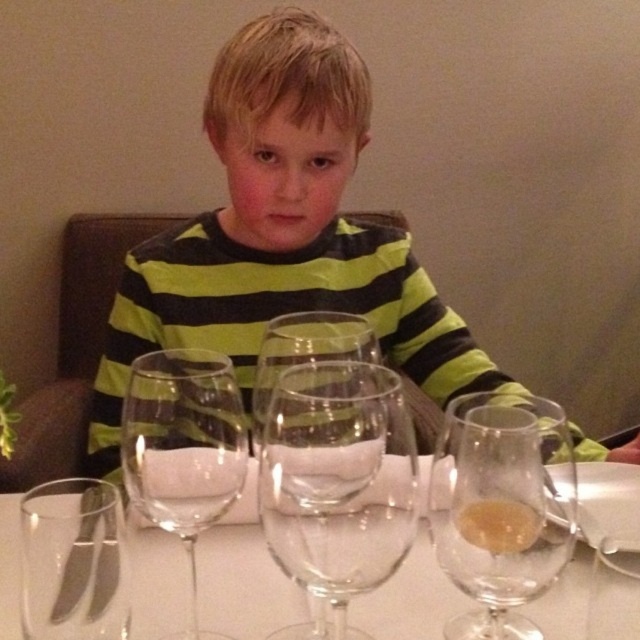
You are a waiter standing at the edge of the table. You need to pick up the translucent glass wine glass at center without touching any other objects. Can you reach it?

The distance between the translucent glass wine glass at center and the viewer is 17.72 inches. Since the average human arm can reach approximately 24 inches, the waiter can easily reach the translucent glass wine glass at center without needing to move closer.

You are a waiter at a restaurant and need to select a wine glass for a customer who prefers a taller glass. Which glass should you choose between the transparent glass wine glass at center and the translucent glass wine glass at center?

The transparent glass wine glass at center has a greater height compared to the translucent glass wine glass at center, so you should choose the transparent glass wine glass at center.

You are a waiter in a restaurant and you need to place a new wine glass on the table. The table has a transparent glass wine glass at center and a translucent glass wine glass at center. Which glass should you place your new wine glass behind to ensure it is closer to the customer?

You should place the new wine glass behind the translucent glass wine glass at center because the transparent glass wine glass at center is already closer to the viewer, so placing it behind the translucent one would position it closer to the customer.